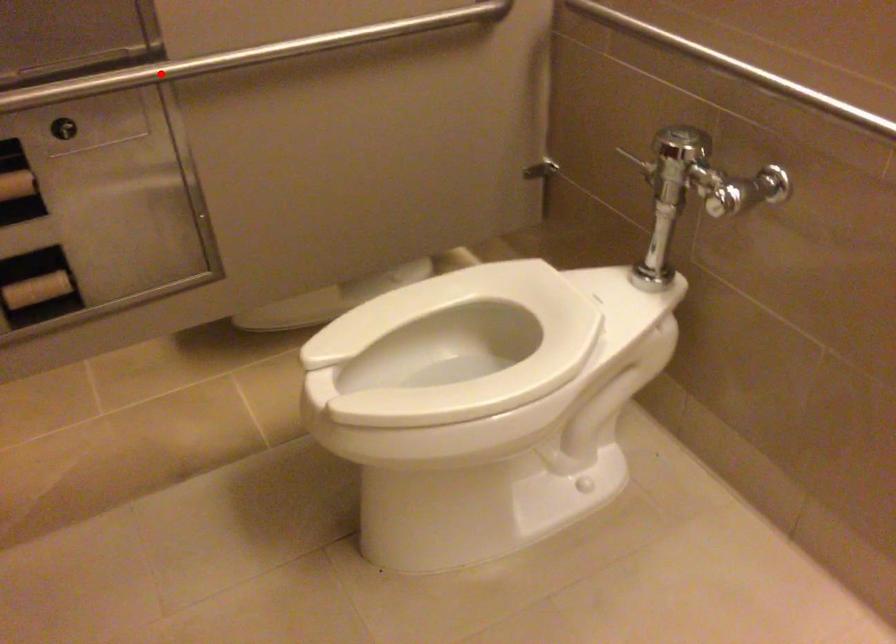
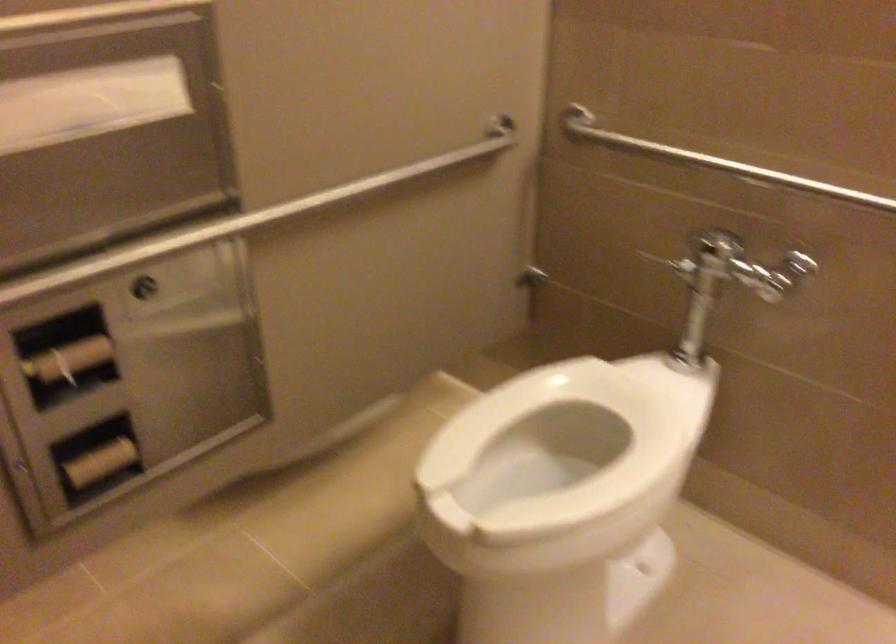
Find the pixel in the second image that matches the highlighted location in the first image.

(246, 220)